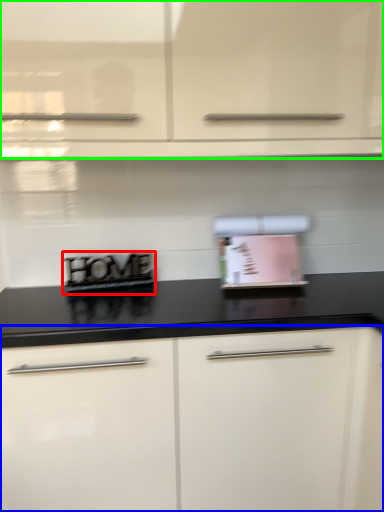
Question: Which object is the closest to the appliance (highlighted by a red box)? Choose among these: cabinetry (highlighted by a blue box) or cabinetry (highlighted by a green box).

Choices:
 (A) cabinetry
 (B) cabinetry

Answer: (A)